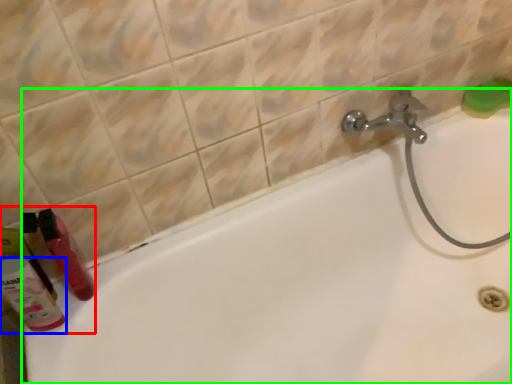
Question: Based on their relative distances, which object is farther from toiletry (highlighted by a red box)? Choose from cleaning product (highlighted by a blue box) and bathtub (highlighted by a green box).

Choices:
 (A) cleaning product
 (B) bathtub

Answer: (B)